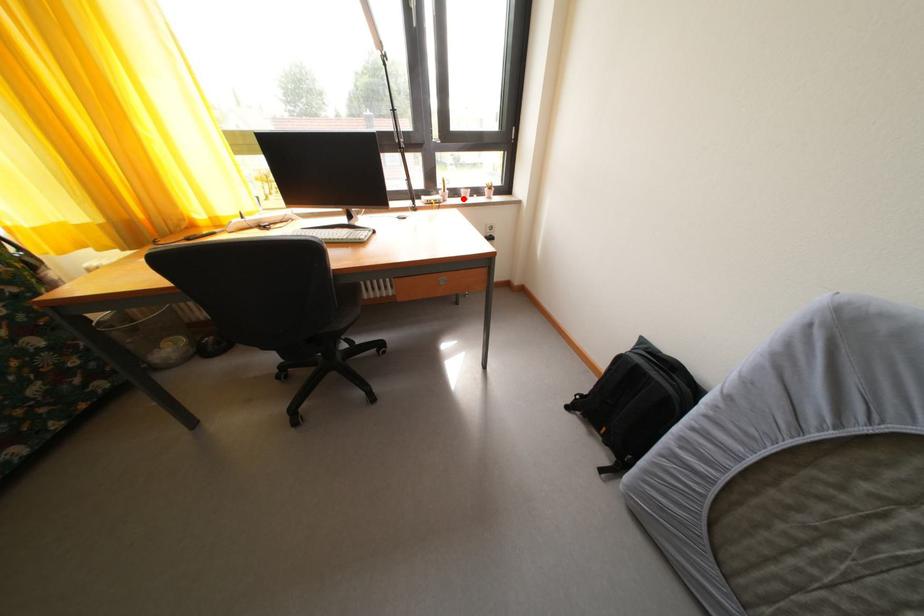
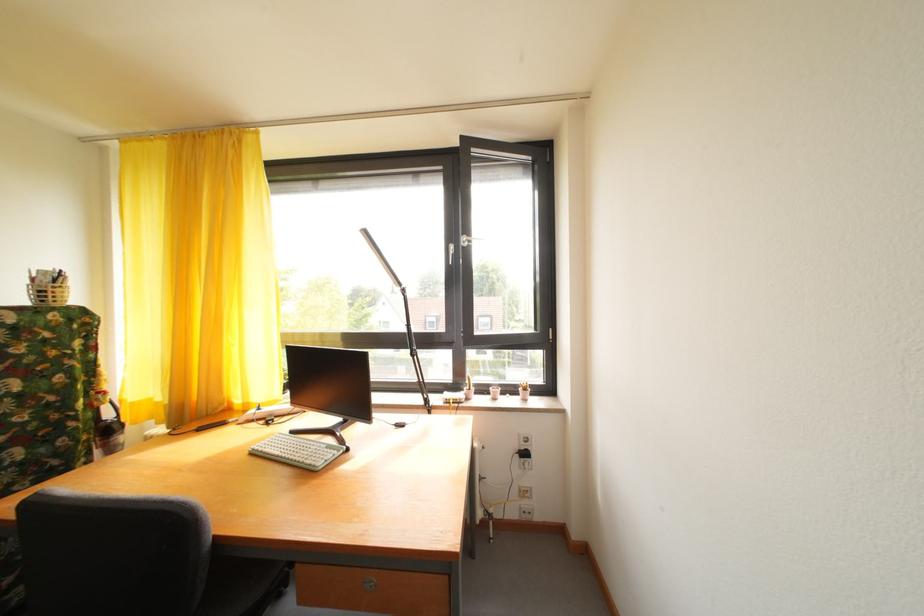
Find the pixel in the second image that matches the highlighted location in the first image.

(492, 395)